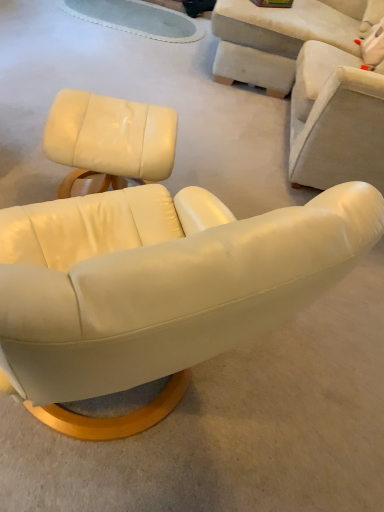
Identify the location of matte white armchair at upper right, which appears as the first chair when viewed from the right. (336, 119).

How much space does matte white leather chair at center, the second chair in the left-to-right sequence, occupy horizontally?

It is 2.93 meters.

This screenshot has height=512, width=384. What do you see at coordinates (108, 141) in the screenshot?
I see `matte white leather ottoman at upper left, placed as the first chair when sorted from left to right` at bounding box center [108, 141].

Locate an element on the screen. Image resolution: width=384 pixels, height=512 pixels. matte white armchair at upper right, the 3th chair viewed from the left is located at coordinates (336, 119).

Is matte white armchair at upper right, which appears as the first chair when viewed from the right, outside of matte white leather ottoman at upper left, placed as the first chair when sorted from left to right?

Yes.

Considering the relative sizes of matte white armchair at upper right, which appears as the first chair when viewed from the right, and matte white leather ottoman at upper left, the 3th chair positioned from the right, in the image provided, is matte white armchair at upper right, which appears as the first chair when viewed from the right, wider than matte white leather ottoman at upper left, the 3th chair positioned from the right,?

No.

Which is in front, point (329, 162) or point (161, 145)?

The point (161, 145) is more forward.

Identify the location of the 2nd chair above the matte white leather ottoman at upper left, the 3th chair positioned from the right (from the image's perspective). (159, 281).

Does matte white leather ottoman at upper left, placed as the first chair when sorted from left to right, have a lesser width compared to matte white leather chair at center, the second chair viewed from the right?

Yes, matte white leather ottoman at upper left, placed as the first chair when sorted from left to right, is thinner than matte white leather chair at center, the second chair viewed from the right.

Does matte white leather ottoman at upper left, placed as the first chair when sorted from left to right, appear on the left side of matte white leather chair at center, the second chair in the left-to-right sequence?

Yes, matte white leather ottoman at upper left, placed as the first chair when sorted from left to right, is to the left of matte white leather chair at center, the second chair in the left-to-right sequence.

Is matte white leather ottoman at upper left, the 3th chair positioned from the right, looking in the opposite direction of matte white armchair at upper right, the 3th chair viewed from the left?

matte white leather ottoman at upper left, the 3th chair positioned from the right, does not have its back to matte white armchair at upper right, the 3th chair viewed from the left.

Between matte white leather ottoman at upper left, the 3th chair positioned from the right, and matte white armchair at upper right, which appears as the first chair when viewed from the right, which one appears on the right side from the viewer's perspective?

matte white armchair at upper right, which appears as the first chair when viewed from the right, is more to the right.

From the image's perspective, which is above, matte white leather ottoman at upper left, the 3th chair positioned from the right, or matte white armchair at upper right, the 3th chair viewed from the left?

matte white armchair at upper right, the 3th chair viewed from the left, is shown above in the image.

Image resolution: width=384 pixels, height=512 pixels. Identify the location of chair to the right of matte white leather chair at center, the second chair in the left-to-right sequence. pyautogui.click(x=336, y=119).

Considering the relative sizes of matte white armchair at upper right, which appears as the first chair when viewed from the right, and matte white leather chair at center, the second chair viewed from the right, in the image provided, is matte white armchair at upper right, which appears as the first chair when viewed from the right, taller than matte white leather chair at center, the second chair viewed from the right,?

Yes.

From a real-world perspective, is matte white armchair at upper right, the 3th chair viewed from the left, on matte white leather chair at center, the second chair viewed from the right?

Yes.

Is matte white armchair at upper right, the 3th chair viewed from the left, bigger than matte white leather chair at center, the second chair viewed from the right?

No.

Could you tell me if matte white leather chair at center, the second chair viewed from the right, is facing matte white armchair at upper right, the 3th chair viewed from the left?

No, matte white leather chair at center, the second chair viewed from the right, is not facing towards matte white armchair at upper right, the 3th chair viewed from the left.

Which is in front, matte white leather chair at center, the second chair viewed from the right, or matte white armchair at upper right, the 3th chair viewed from the left?

matte white leather chair at center, the second chair viewed from the right, is more forward.

From the image's perspective, is matte white leather chair at center, the second chair viewed from the right, beneath matte white armchair at upper right, the 3th chair viewed from the left?

Actually, matte white leather chair at center, the second chair viewed from the right, appears above matte white armchair at upper right, the 3th chair viewed from the left, in the image.

The height and width of the screenshot is (512, 384). I want to click on the 2nd chair behind the matte white leather chair at center, the second chair viewed from the right, so click(336, 119).

Can you tell me how much matte white leather chair at center, the second chair in the left-to-right sequence, and matte white leather ottoman at upper left, placed as the first chair when sorted from left to right, differ in facing direction?

79.1 degrees.

Which object is thinner, matte white leather chair at center, the second chair viewed from the right, or matte white leather ottoman at upper left, placed as the first chair when sorted from left to right?

With smaller width is matte white leather ottoman at upper left, placed as the first chair when sorted from left to right.

From a real-world perspective, between matte white leather chair at center, the second chair viewed from the right, and matte white leather ottoman at upper left, the 3th chair positioned from the right, who is vertically lower?

In real-world perspective, matte white leather chair at center, the second chair viewed from the right, is lower.

You are a GUI agent. You are given a task and a screenshot of the screen. Output one action in this format:
    pyautogui.click(x=<x>, y=<y>)
    Task: Click on the 2nd chair to the left of the matte white armchair at upper right, the 3th chair viewed from the left, counting from the anchor's position
    This screenshot has width=384, height=512.
    Given the screenshot: What is the action you would take?
    pyautogui.click(x=108, y=141)

The image size is (384, 512). What are the coordinates of `the 1st chair directly above the matte white leather chair at center, the second chair viewed from the right (from a real-world perspective)` in the screenshot? It's located at (108, 141).

From the image, which object appears to be nearer to matte white armchair at upper right, the 3th chair viewed from the left, matte white leather chair at center, the second chair viewed from the right, or matte white leather ottoman at upper left, placed as the first chair when sorted from left to right?

matte white leather ottoman at upper left, placed as the first chair when sorted from left to right, lies closer to matte white armchair at upper right, the 3th chair viewed from the left, than the other object.

When comparing their distances from matte white leather ottoman at upper left, the 3th chair positioned from the right, does matte white leather chair at center, the second chair in the left-to-right sequence, or matte white armchair at upper right, the 3th chair viewed from the left, seem further?

matte white leather chair at center, the second chair in the left-to-right sequence, is positioned further to the anchor matte white leather ottoman at upper left, the 3th chair positioned from the right.

Which object lies nearer to the anchor point matte white leather chair at center, the second chair in the left-to-right sequence, matte white leather ottoman at upper left, placed as the first chair when sorted from left to right, or matte white armchair at upper right, the 3th chair viewed from the left?

matte white leather ottoman at upper left, placed as the first chair when sorted from left to right.

From the image, which object appears to be farther from matte white leather chair at center, the second chair viewed from the right, matte white armchair at upper right, which appears as the first chair when viewed from the right, or matte white leather ottoman at upper left, placed as the first chair when sorted from left to right?

The object further to matte white leather chair at center, the second chair viewed from the right, is matte white armchair at upper right, which appears as the first chair when viewed from the right.

Which object lies further to the anchor point matte white leather ottoman at upper left, placed as the first chair when sorted from left to right, matte white armchair at upper right, the 3th chair viewed from the left, or matte white leather chair at center, the second chair viewed from the right?

matte white leather chair at center, the second chair viewed from the right, lies further to matte white leather ottoman at upper left, placed as the first chair when sorted from left to right, than the other object.

Estimate the real-world distances between objects in this image. Which object is further from matte white armchair at upper right, the 3th chair viewed from the left, matte white leather ottoman at upper left, the 3th chair positioned from the right, or matte white leather chair at center, the second chair viewed from the right?

Among the two, matte white leather chair at center, the second chair viewed from the right, is located further to matte white armchair at upper right, the 3th chair viewed from the left.

The image size is (384, 512). I want to click on chair situated between matte white leather ottoman at upper left, the 3th chair positioned from the right, and matte white armchair at upper right, the 3th chair viewed from the left, from left to right, so click(159, 281).